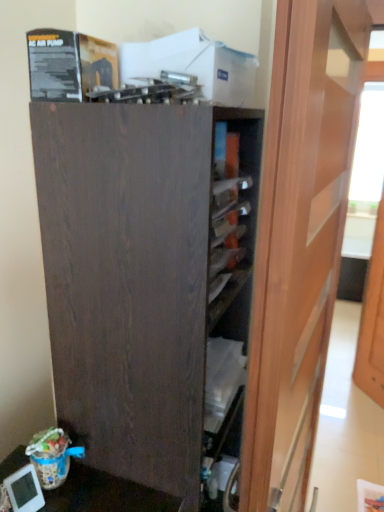
Question: Is matte wood door at center, arranged as the second door when viewed from the back, further to the viewer compared to wooden door at right, marked as the second door in a front-to-back arrangement?

Choices:
 (A) yes
 (B) no

Answer: (B)

Question: Is matte wood door at center, arranged as the second door when viewed from the back, closer to the viewer compared to wooden door at right, arranged as the 2th door when viewed from the left?

Choices:
 (A) no
 (B) yes

Answer: (B)

Question: Is matte wood door at center, the first door viewed from the front, wider than wooden door at right, marked as the second door in a front-to-back arrangement?

Choices:
 (A) no
 (B) yes

Answer: (B)

Question: Is matte wood door at center, the 1th door viewed from the left, to the right of wooden door at right, which is counted as the 1th door, starting from the right, from the viewer's perspective?

Choices:
 (A) yes
 (B) no

Answer: (B)

Question: Is matte wood door at center, arranged as the second door when viewed from the back, facing towards wooden door at right, marked as the second door in a front-to-back arrangement?

Choices:
 (A) no
 (B) yes

Answer: (A)

Question: Is matte wood door at center, arranged as the second door when viewed from the back, positioned with its back to wooden door at right, marked as the second door in a front-to-back arrangement?

Choices:
 (A) yes
 (B) no

Answer: (B)

Question: Does wooden door at right, which is counted as the 1th door, starting from the right, have a greater width compared to dark wood cupboard at center?

Choices:
 (A) no
 (B) yes

Answer: (A)

Question: From the image's perspective, does wooden door at right, marked as the 1th door in a back-to-front arrangement, appear lower than dark wood cupboard at center?

Choices:
 (A) no
 (B) yes

Answer: (A)

Question: Is dark wood cupboard at center at the back of wooden door at right, marked as the second door in a front-to-back arrangement?

Choices:
 (A) yes
 (B) no

Answer: (B)

Question: Are wooden door at right, arranged as the 2th door when viewed from the left, and dark wood cupboard at center making contact?

Choices:
 (A) no
 (B) yes

Answer: (A)

Question: Are wooden door at right, which is counted as the 1th door, starting from the right, and dark wood cupboard at center located far from each other?

Choices:
 (A) yes
 (B) no

Answer: (A)

Question: Considering the relative positions of wooden door at right, marked as the second door in a front-to-back arrangement, and dark wood cupboard at center in the image provided, is wooden door at right, marked as the second door in a front-to-back arrangement, to the right of dark wood cupboard at center from the viewer's perspective?

Choices:
 (A) no
 (B) yes

Answer: (B)

Question: From a real-world perspective, is matte wood door at center, arranged as the second door when viewed from the back, positioned under dark wood cupboard at center based on gravity?

Choices:
 (A) no
 (B) yes

Answer: (A)